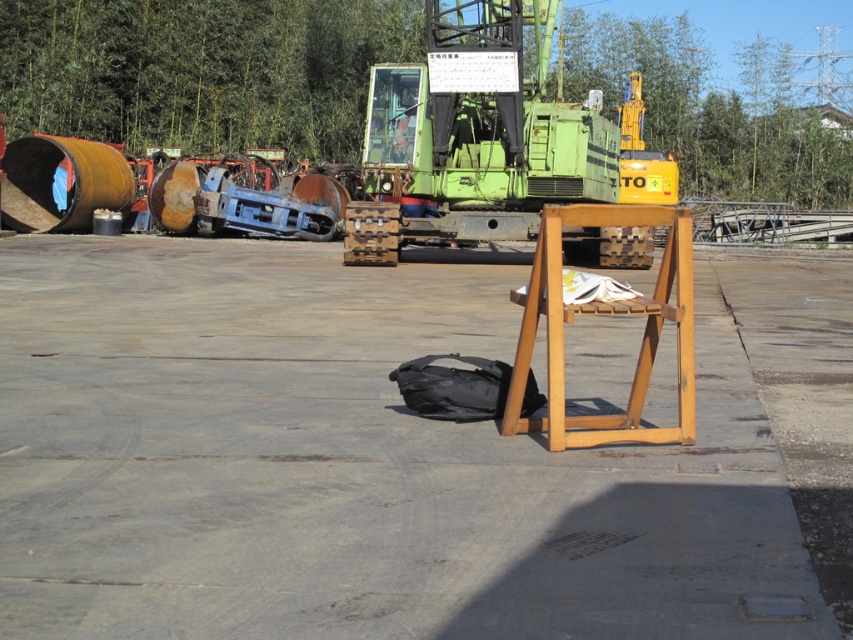
Question: Which point is closer to the camera?

Choices:
 (A) (532, 205)
 (B) (82, 221)

Answer: (A)

Question: Is green matte forklift at center closer to the viewer compared to rusty metal barrel at left?

Choices:
 (A) yes
 (B) no

Answer: (A)

Question: Which point appears closest to the camera in this image?

Choices:
 (A) (96, 419)
 (B) (15, 173)
 (C) (657, 195)

Answer: (A)

Question: Which is farther from the green matte forklift at center?

Choices:
 (A) wooden table at center
 (B) rusty metal barrel at left

Answer: (B)

Question: Can you confirm if wooden table at center is positioned to the left of rusty metal barrel at left?

Choices:
 (A) yes
 (B) no

Answer: (B)

Question: Can you confirm if green matte forklift at center is positioned below rusty metal barrel at left?

Choices:
 (A) yes
 (B) no

Answer: (B)